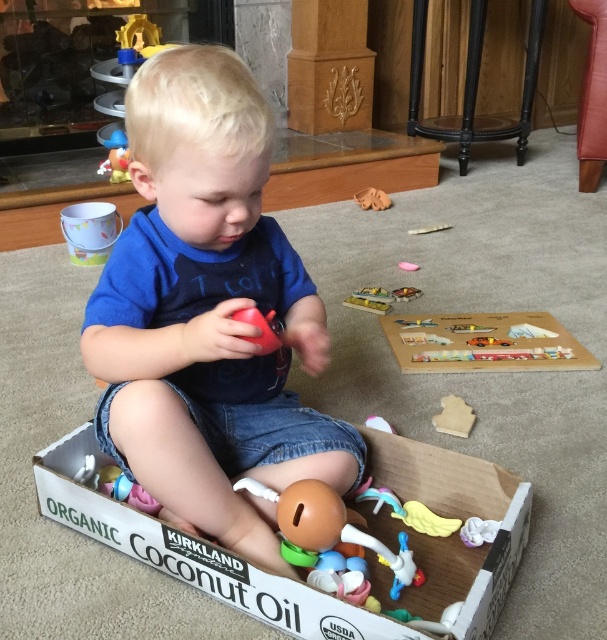
Does white cardboard box at center have a lesser width compared to rubberized plastic toy at lower center?

No, white cardboard box at center is not thinner than rubberized plastic toy at lower center.

Can you confirm if white cardboard box at center is smaller than rubberized plastic toy at lower center?

No, white cardboard box at center is not smaller than rubberized plastic toy at lower center.

Locate an element on the screen. The image size is (607, 640). white cardboard box at center is located at coordinates (452, 532).

Does rubberized plastic ball at center appear on the left side of brown fabric toy at center?

Correct, you'll find rubberized plastic ball at center to the left of brown fabric toy at center.

Between rubberized plastic ball at center and brown fabric toy at center, which one appears on the right side from the viewer's perspective?

Positioned to the right is brown fabric toy at center.

In order to click on rubberized plastic ball at center in this screenshot , I will do `click(260, 328)`.

Between wooden puzzle board at center and white fabric toy at lower right, which one has less height?

white fabric toy at lower right is shorter.

Who is higher up, wooden puzzle board at center or white fabric toy at lower right?

wooden puzzle board at center is higher up.

At what (x,y) coordinates should I click in order to perform the action: click on wooden puzzle board at center. Please return your answer as a coordinate pair (x, y). Looking at the image, I should click on (483, 342).